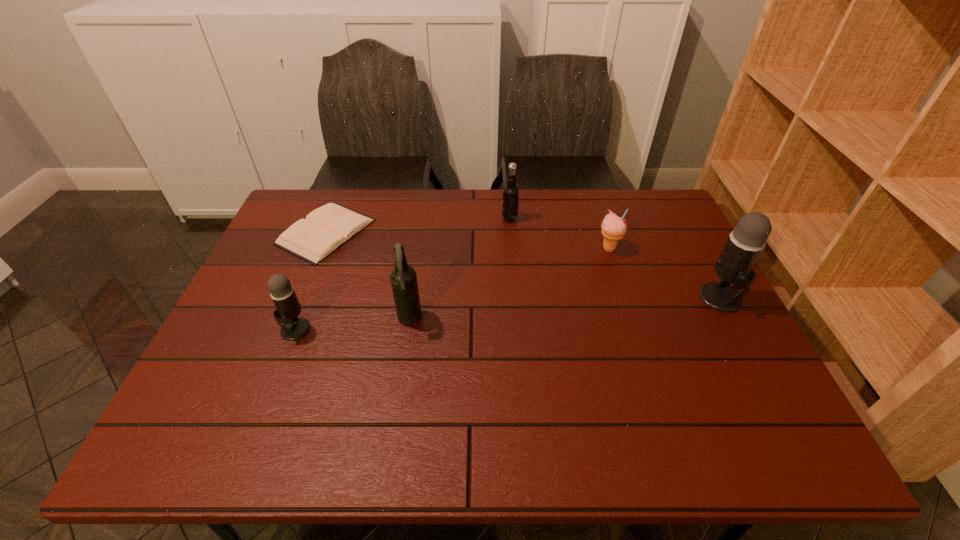
Where is `hardback book that is positioned at the left edge`? The width and height of the screenshot is (960, 540). hardback book that is positioned at the left edge is located at coordinates (327, 228).

You are a GUI agent. You are given a task and a screenshot of the screen. Output one action in this format:
    pyautogui.click(x=<x>, y=<y>)
    Task: Click on the object that is at the right edge
    This screenshot has width=960, height=540.
    Given the screenshot: What is the action you would take?
    pyautogui.click(x=745, y=243)

Locate an element on the screen. The width and height of the screenshot is (960, 540). object at the far left corner is located at coordinates (327, 228).

The height and width of the screenshot is (540, 960). In the image, there is a desktop. Identify the location of free space at the far edge. (500, 225).

In the image, there is a desktop. At what (x,y) coordinates should I click in order to perform the action: click on vacant space at the near edge. Please return your answer as a coordinate pair (x, y). Looking at the image, I should click on (511, 391).

Image resolution: width=960 pixels, height=540 pixels. In the image, there is a desktop. What are the coordinates of `vacant region at the right edge` in the screenshot? It's located at (697, 362).

The width and height of the screenshot is (960, 540). In order to click on vacant space that's between the shorter microphone and the right microphone in this screenshot , I will do `click(508, 314)`.

Find the location of a particular element. The height and width of the screenshot is (540, 960). blank region between the hardback book and the fifth object from left to right is located at coordinates (468, 240).

In order to click on free space between the beer bottle and the shortest object in this screenshot , I will do `click(368, 276)`.

This screenshot has height=540, width=960. Identify the location of unoccupied position between the icecream and the fourth object from left to right. (560, 234).